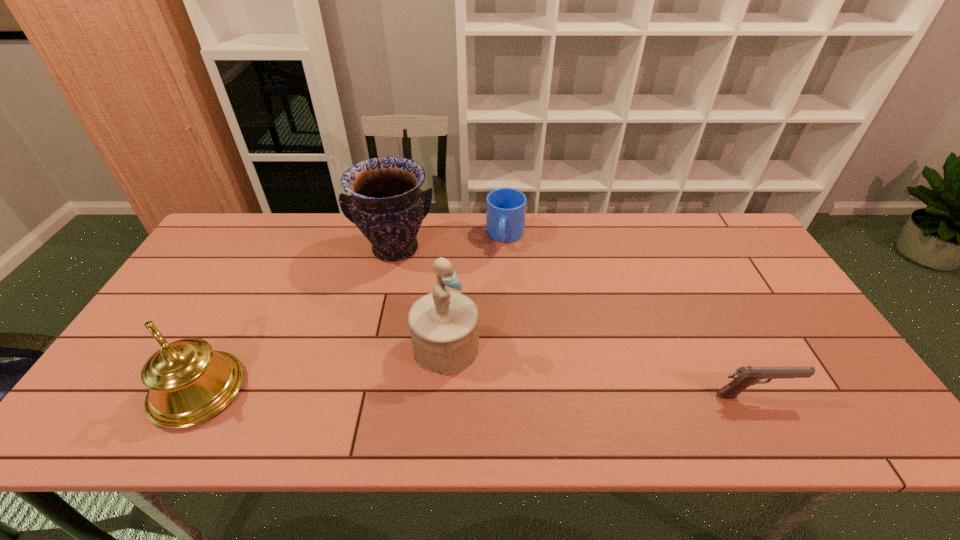
The height and width of the screenshot is (540, 960). I want to click on the leftmost object, so click(x=189, y=383).

Locate an element on the screen. The width and height of the screenshot is (960, 540). the rightmost object is located at coordinates (745, 376).

The image size is (960, 540). Find the location of `the shortest object`. the shortest object is located at coordinates (x=745, y=376).

Where is `mug`? This screenshot has width=960, height=540. mug is located at coordinates (505, 207).

You are a GUI agent. You are given a task and a screenshot of the screen. Output one action in this format:
    pyautogui.click(x=<x>, y=<y>)
    Task: Click on the pottery
    The width and height of the screenshot is (960, 540).
    Given the screenshot: What is the action you would take?
    pyautogui.click(x=386, y=204)

The image size is (960, 540). What are the coordinates of `figurine` in the screenshot? It's located at (444, 329).

The width and height of the screenshot is (960, 540). Identify the location of free location located on the right of the leftmost object. (268, 390).

The height and width of the screenshot is (540, 960). What are the coordinates of `free space located 0.060m at the barrel of the shortest object` in the screenshot? It's located at (818, 396).

The height and width of the screenshot is (540, 960). I want to click on vacant area situated 0.110m on the side of the second object from right to left with the handle, so click(x=498, y=275).

You are a GUI agent. You are given a task and a screenshot of the screen. Output one action in this format:
    pyautogui.click(x=<x>, y=<y>)
    Task: Click on the vacant region located 0.380m on the side of the second object from right to left with the handle
    
    Given the screenshot: What is the action you would take?
    pyautogui.click(x=485, y=346)